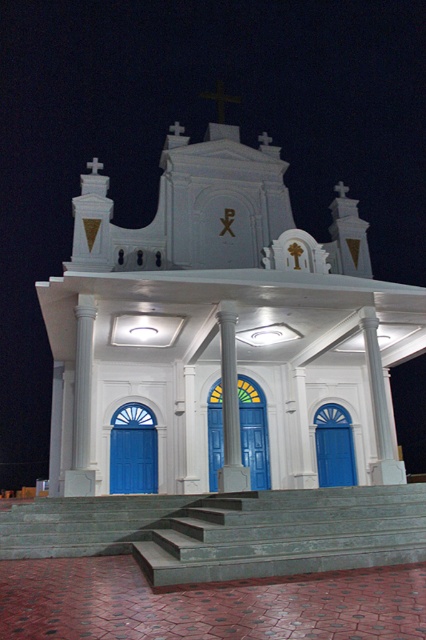
Which of these two, smooth concrete stairs at center or blue glossy door at center, stands taller?

With more height is blue glossy door at center.

The width and height of the screenshot is (426, 640). What do you see at coordinates (227, 531) in the screenshot?
I see `smooth concrete stairs at center` at bounding box center [227, 531].

Find the location of a particular element. This screenshot has height=640, width=426. smooth concrete stairs at center is located at coordinates (227, 531).

Is white glossy church at center to the left of blue glossy door at center from the viewer's perspective?

Indeed, white glossy church at center is positioned on the left side of blue glossy door at center.

Can you confirm if white glossy church at center is bigger than blue glossy door at center?

Correct, white glossy church at center is larger in size than blue glossy door at center.

What do you see at coordinates (218, 323) in the screenshot?
I see `white glossy church at center` at bounding box center [218, 323].

Locate an element on the screen. Image resolution: width=426 pixels, height=640 pixels. white glossy church at center is located at coordinates (218, 323).

Is the position of white glossy church at center more distant than that of white smooth column at center?

No, white glossy church at center is in front of white smooth column at center.

Is point (60, 276) positioned before point (230, 417)?

That is True.

Is point (98, 280) positioned in front of point (222, 312)?

Yes, point (98, 280) is closer to viewer.

At what (x,y) coordinates should I click in order to perform the action: click on white glossy church at center. Please return your answer as a coordinate pair (x, y). The width and height of the screenshot is (426, 640). Looking at the image, I should click on (218, 323).